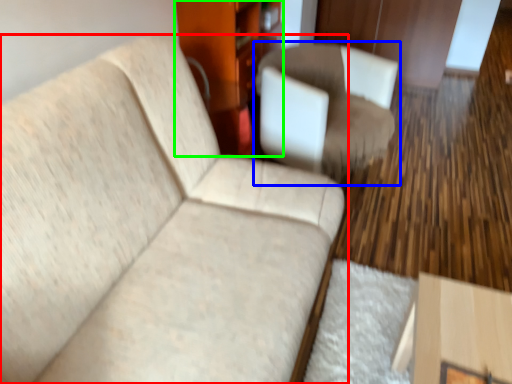
Question: Estimate the real-world distances between objects in this image. Which object is closer to studio couch (highlighted by a red box), chair (highlighted by a blue box) or dresser (highlighted by a green box)?

Choices:
 (A) chair
 (B) dresser

Answer: (A)